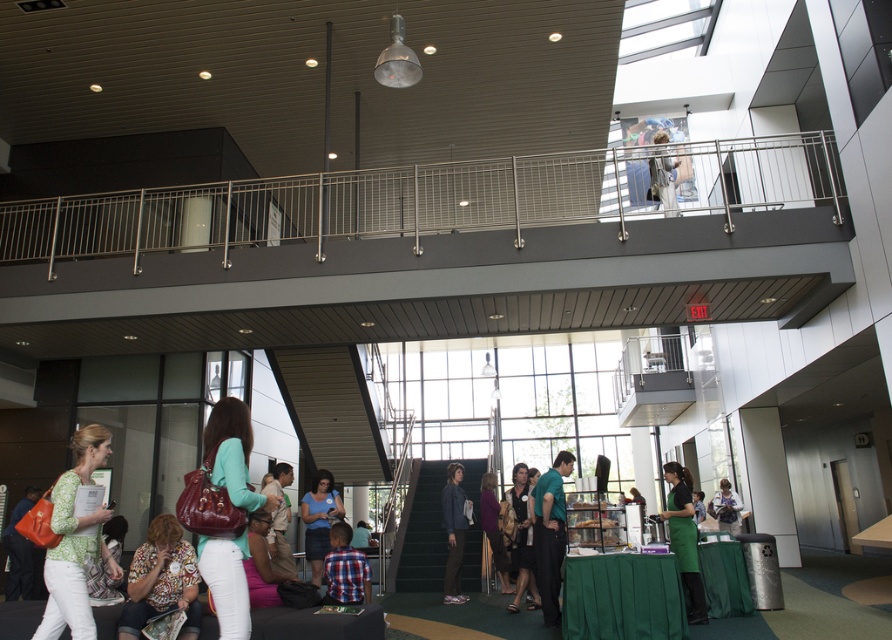
You are organizing a photo shoot and need to know if the green matte shirt at lower left and the plaid shirt at center can be captured in a single frame without cropping. Based on their widths, is this possible?

The green matte shirt at lower left might be wider than plaid shirt at center. However, without exact measurements, it is uncertain if they can fit in a single frame. Consider adjusting the camera angle or zoom level for better composition.

You are a security guard in the convention center and you need to locate the matte brown purse at lower left and the matte black jacket at lower left. Which one is positioned higher in the scene?

The matte brown purse at lower left is above the matte black jacket at lower left, so the matte brown purse at lower left is positioned higher.

You are a security guard in the convention center and need to check both the matte brown purse at lower left and the pink fabric at lower center. Which object should you inspect first based on their proximity to your current position?

The matte brown purse at lower left is closer to the viewer than the pink fabric at lower center, so you should inspect the matte brown purse at lower left first.